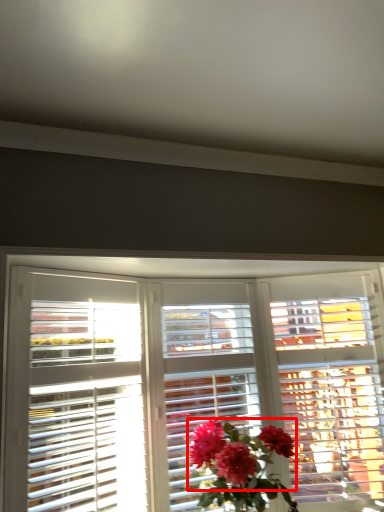
Question: From the image's perspective, where is flower (annotated by the red box) located relative to window?

Choices:
 (A) above
 (B) below

Answer: (B)